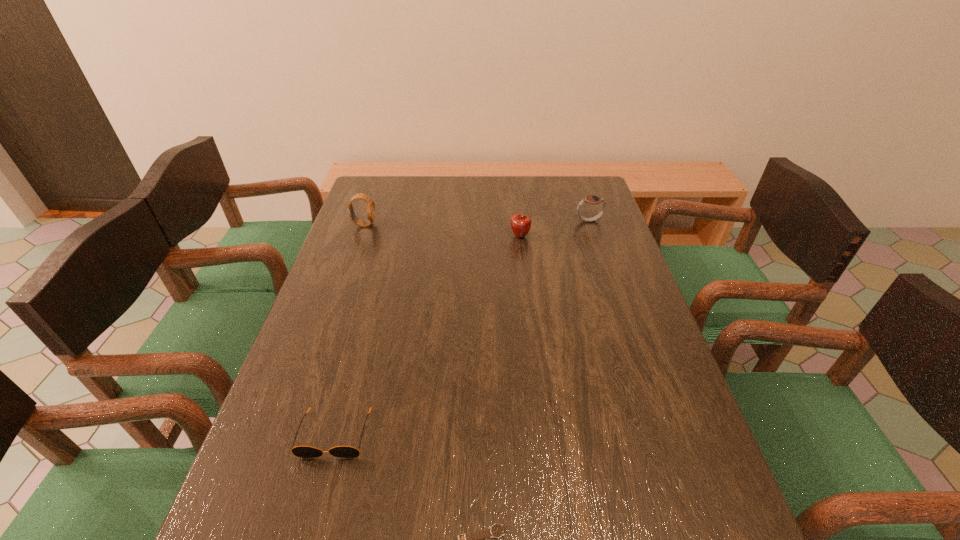
This screenshot has height=540, width=960. Identify the location of unoccupied position between the second shortest object and the tallest object. (349, 329).

Locate an element on the screen. This screenshot has width=960, height=540. free point between the fourth farthest object and the fourth object from left to right is located at coordinates (427, 335).

The height and width of the screenshot is (540, 960). In order to click on free space that is in between the second shortest watch and the fourth object from left to right in this screenshot , I will do `click(555, 228)`.

Where is `blank region between the apple and the tallest watch`? blank region between the apple and the tallest watch is located at coordinates (442, 231).

In order to click on empty space between the second shortest watch and the third nearest object in this screenshot , I will do `click(555, 228)`.

Find the location of a particular element. This screenshot has height=540, width=960. free space between the tallest object and the second object from right to left is located at coordinates (442, 231).

At what (x,y) coordinates should I click in order to perform the action: click on free spot between the sunglasses and the apple. Please return your answer as a coordinate pair (x, y). Looking at the image, I should click on (427, 335).

Where is `vacant area that lies between the fourth tallest object and the rightmost object`? vacant area that lies between the fourth tallest object and the rightmost object is located at coordinates (462, 327).

Image resolution: width=960 pixels, height=540 pixels. In order to click on object identified as the fourth closest to the second shortest watch in this screenshot , I will do click(472, 539).

Point out which object is positioned as the third nearest to the rightmost watch. Please provide its 2D coordinates. Your answer should be formatted as a tuple, i.e. [(x, y)], where the tuple contains the x and y coordinates of a point satisfying the conditions above.

[(299, 451)]